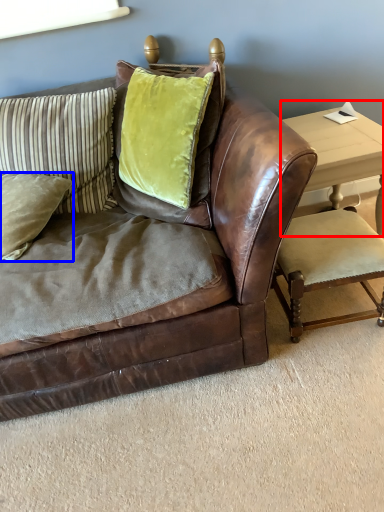
Question: Which of the following is the closest to the observer, table (highlighted by a red box) or pillow (highlighted by a blue box)?

Choices:
 (A) table
 (B) pillow

Answer: (B)